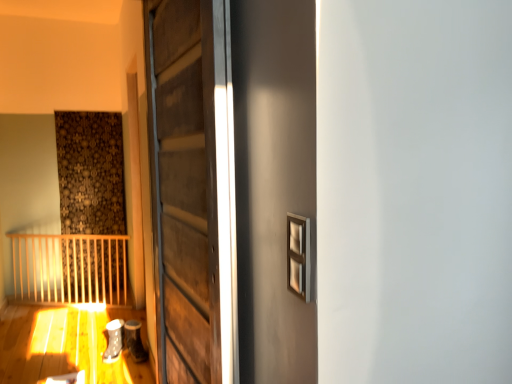
Question: From a real-world perspective, relative to matte gray shoe at lower left, the 2th shoe in the left-to-right sequence, is white matte shoe at lower left, the 2th shoe positioned from the right, vertically above or below?

Choices:
 (A) below
 (B) above

Answer: (A)

Question: Based on their positions, is white matte shoe at lower left, the 2th shoe positioned from the right, located to the left or right of matte gray shoe at lower left, the first shoe from the right?

Choices:
 (A) right
 (B) left

Answer: (B)

Question: Estimate the real-world distances between objects in this image. Which object is farther from the wooden door at center?

Choices:
 (A) matte gray shoe at lower left, the first shoe from the right
 (B) white matte shoe at lower left, the 2th shoe positioned from the right

Answer: (A)

Question: Based on their relative distances, which object is nearer to the white matte shoe at lower left, the 2th shoe positioned from the right?

Choices:
 (A) wooden door at center
 (B) matte gray shoe at lower left, the first shoe from the right

Answer: (B)